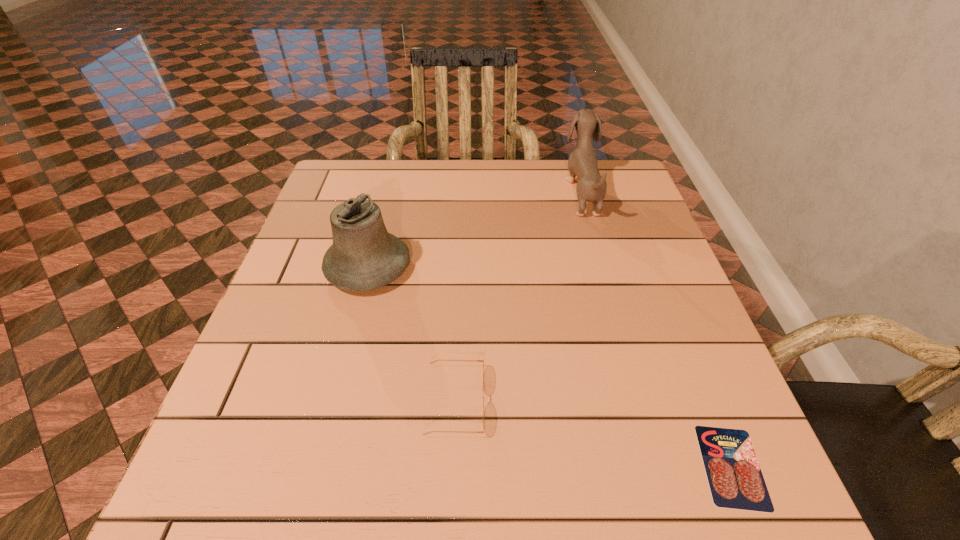
Identify the location of the third object from left to right. (591, 186).

Locate an element on the screen. This screenshot has width=960, height=540. puppy is located at coordinates (591, 186).

Locate an element on the screen. The image size is (960, 540). the leftmost object is located at coordinates (364, 256).

Locate an element on the screen. The width and height of the screenshot is (960, 540). the second farthest object is located at coordinates (364, 256).

Identify the location of the second shortest object. (483, 359).

Locate an element on the screen. the third object from right to left is located at coordinates coord(483,359).

I want to click on the shortest object, so click(x=734, y=475).

Locate an element on the screen. The height and width of the screenshot is (540, 960). the rightmost object is located at coordinates (734, 475).

Find the location of a particular element. free space located at the face of the puppy is located at coordinates (523, 192).

At what (x,y) coordinates should I click in order to perform the action: click on free location located at the face of the puppy. Please return your answer as a coordinate pair (x, y). This screenshot has width=960, height=540. Looking at the image, I should click on (427, 192).